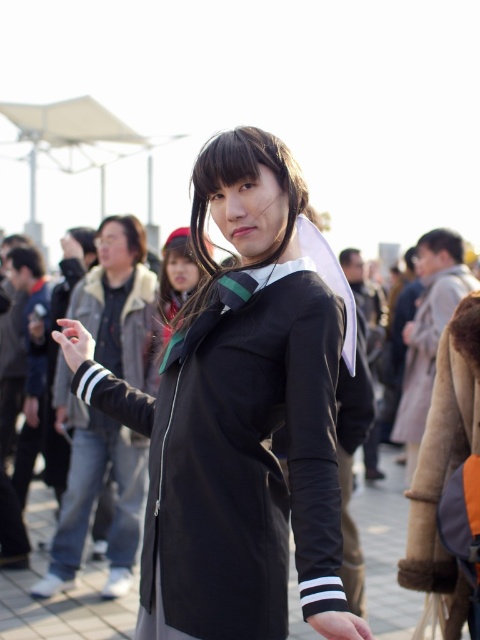
In the scene shown: Can you confirm if beige fur coat at right is smaller than black matte jacket at center?

Correct, beige fur coat at right occupies less space than black matte jacket at center.

From the picture: Does beige fur coat at right have a lesser width compared to black matte jacket at center?

Indeed, beige fur coat at right has a lesser width compared to black matte jacket at center.

Is point (412, 524) farther from camera compared to point (153, 307)?

No, (412, 524) is in front of (153, 307).

Where is `beige fur coat at right`? beige fur coat at right is located at coordinates click(x=444, y=449).

In the scene shown: Is black fabric dress at center shorter than beige fur coat at right?

No, black fabric dress at center is not shorter than beige fur coat at right.

Between black fabric dress at center and beige fur coat at right, which one has less height?

beige fur coat at right

Does point (317, 525) come closer to viewer compared to point (428, 512)?

Yes.

This screenshot has height=640, width=480. Identify the location of black fabric dress at center. (239, 417).

Who is higher up, black fabric dress at center or black matte jacket at center?

black matte jacket at center

Can you confirm if black fabric dress at center is positioned above black matte jacket at center?

Incorrect, black fabric dress at center is not positioned above black matte jacket at center.

Which is behind, point (124, 424) or point (104, 356)?

Point (104, 356)

The height and width of the screenshot is (640, 480). I want to click on black fabric dress at center, so click(x=239, y=417).